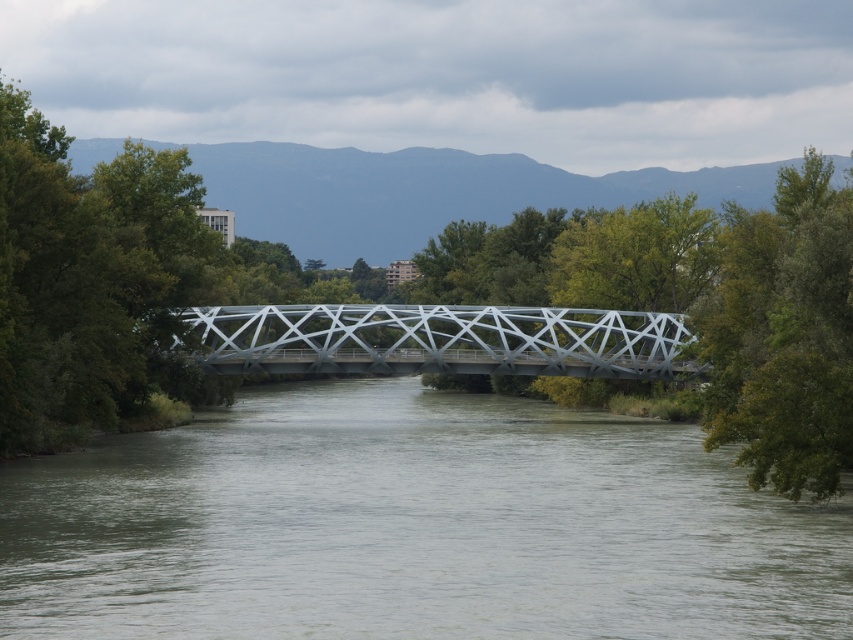
Describe the element at coordinates (91, 280) in the screenshot. Image resolution: width=853 pixels, height=640 pixels. I see `green leafy tree at left` at that location.

Is the position of green leafy tree at left more distant than that of metallic gray bridge at center?

No, it is not.

Is point (161, 317) positioned in front of point (573, 337)?

That is True.

Identify the location of green leafy tree at left. Image resolution: width=853 pixels, height=640 pixels. (91, 280).

Between point (86, 636) and point (820, 477), which one is positioned behind?

The point (820, 477) is behind.

Where is `greenish-gray water at center`? The width and height of the screenshot is (853, 640). greenish-gray water at center is located at coordinates (412, 528).

Who is positioned more to the right, greenish-gray water at center or green leafy tree at center?

Positioned to the right is green leafy tree at center.

Is point (155, 476) farther from camera compared to point (53, 348)?

No, it is not.

Where is `greenish-gray water at center`? greenish-gray water at center is located at coordinates (412, 528).